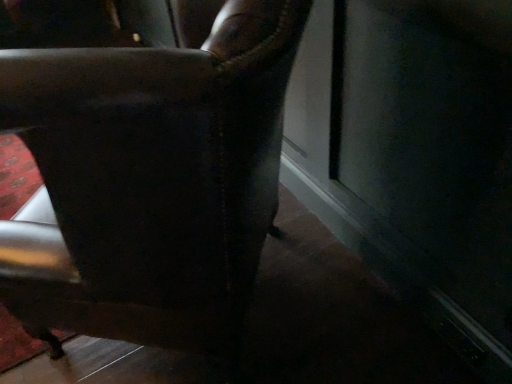
The width and height of the screenshot is (512, 384). Describe the element at coordinates (150, 182) in the screenshot. I see `leather chair at center` at that location.

This screenshot has height=384, width=512. I want to click on leather chair at center, so click(x=150, y=182).

Where is `leather chair at center`? leather chair at center is located at coordinates (150, 182).